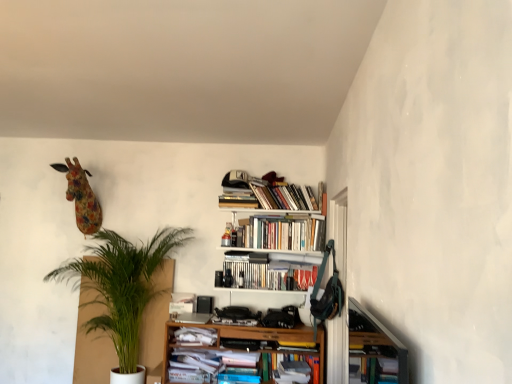
Question: Is hardcover books at upper center, the 1th book viewed from the top, with hardcover books at center, the 3th book positioned from the bottom?

Choices:
 (A) yes
 (B) no

Answer: (B)

Question: Is hardcover books at upper center, which is the fifth book in bottom-to-top order, located outside hardcover books at center, the 3th book positioned from the bottom?

Choices:
 (A) yes
 (B) no

Answer: (A)

Question: Is hardcover books at upper center, which is the fifth book in bottom-to-top order, smaller than hardcover books at center, the 3th book positioned from the bottom?

Choices:
 (A) yes
 (B) no

Answer: (B)

Question: Is hardcover books at upper center, which is the fifth book in bottom-to-top order, not close to hardcover books at center, the 3th book positioned from the bottom?

Choices:
 (A) no
 (B) yes

Answer: (A)

Question: From a real-world perspective, is hardcover books at upper center, which is the fifth book in bottom-to-top order, located higher than hardcover books at center, the 3th book from the top?

Choices:
 (A) no
 (B) yes

Answer: (B)

Question: Is hardcover books at upper center, which is the fifth book in bottom-to-top order, oriented away from hardcover books at center, the 3th book from the top?

Choices:
 (A) no
 (B) yes

Answer: (A)

Question: From a real-world perspective, is hardcover books at upper center, which is the 4th book from bottom to top, on hardcover books at center, the 3th book positioned from the bottom?

Choices:
 (A) no
 (B) yes

Answer: (B)

Question: Is hardcover books at upper center, which is the 4th book from bottom to top, closer to camera compared to hardcover books at center, the 3th book from the top?

Choices:
 (A) yes
 (B) no

Answer: (A)

Question: Does hardcover books at upper center, which is counted as the 2th book, starting from the top, come behind hardcover books at center, the 3th book from the top?

Choices:
 (A) no
 (B) yes

Answer: (A)

Question: Can hardcover books at center, the 3th book from the top, be found inside hardcover books at upper center, which is counted as the 2th book, starting from the top?

Choices:
 (A) yes
 (B) no

Answer: (B)

Question: Does hardcover books at upper center, which is the 4th book from bottom to top, have a lesser height compared to hardcover books at center, the 3th book from the top?

Choices:
 (A) yes
 (B) no

Answer: (B)

Question: Considering the relative sizes of hardcover books at upper center, which is the 4th book from bottom to top, and hardcover books at center, the 3th book from the top, in the image provided, is hardcover books at upper center, which is the 4th book from bottom to top, smaller than hardcover books at center, the 3th book from the top,?

Choices:
 (A) no
 (B) yes

Answer: (A)

Question: Considering the relative positions of white paper at lower center, the fourth book when ordered from top to bottom, and floral fabric giraffe at upper left in the image provided, is white paper at lower center, the fourth book when ordered from top to bottom, to the left of floral fabric giraffe at upper left from the viewer's perspective?

Choices:
 (A) yes
 (B) no

Answer: (B)